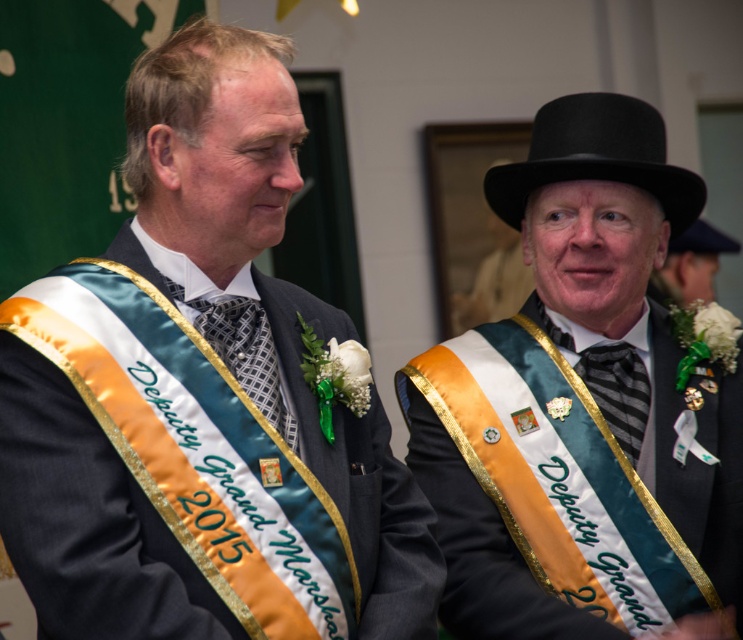
Based on the scene description, where is the matte black sash at left located in terms of its 2D coordinates?

The matte black sash at left is located at coordinates point (201, 396).

You are a photographer setting up for a formal event. You need to ensure that the black felt dress hat at upper right and the matte black hat at upper right are both visible in your composition. Given their sizes, which hat should you prioritize framing closer to the edge of the frame to avoid cropping?

The black felt dress hat at upper right occupies less space than the matte black hat at upper right, so you should prioritize framing the smaller black felt dress hat at upper right closer to the edge to ensure it remains fully visible without cropping.

You are a photographer standing at the back of the ceremony venue. You want to take a photo of the patterned silk tie at center and the black felt dress hat at upper center. Can you fit both objects in the frame if your camera has a maximum field of view of 7 meters?

The distance between the patterned silk tie at center and the black felt dress hat at upper center is 7.50 meters, which exceeds the camera field of view of 7 meters. Therefore, both objects cannot be captured in a single frame.